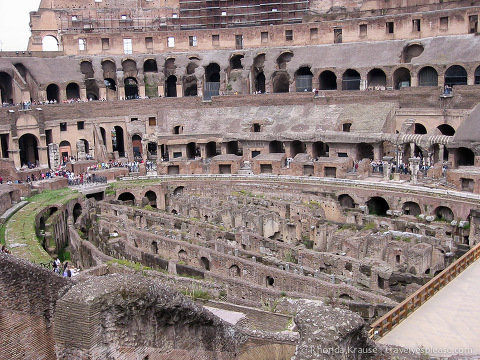
Image resolution: width=480 pixels, height=360 pixels. In order to click on low arches in this screenshot , I will do `click(180, 256)`, `click(206, 260)`, `click(235, 269)`, `click(270, 280)`.